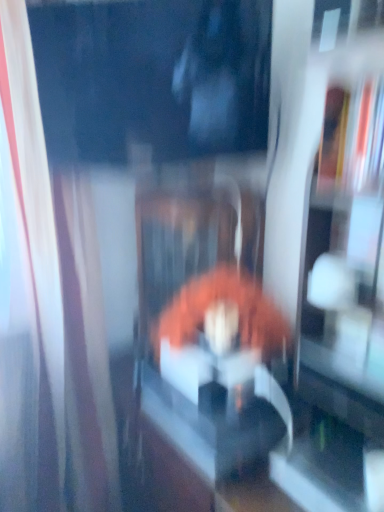
Describe the element at coordinates (62, 285) in the screenshot. I see `white sheer curtain at left` at that location.

Locate an element on the screen. white sheer curtain at left is located at coordinates (62, 285).

You are a GUI agent. You are given a task and a screenshot of the screen. Output one action in this format:
    pyautogui.click(x=<x>, y=<y>)
    Task: Click on the white sheer curtain at left
    
    Given the screenshot: What is the action you would take?
    pyautogui.click(x=62, y=285)